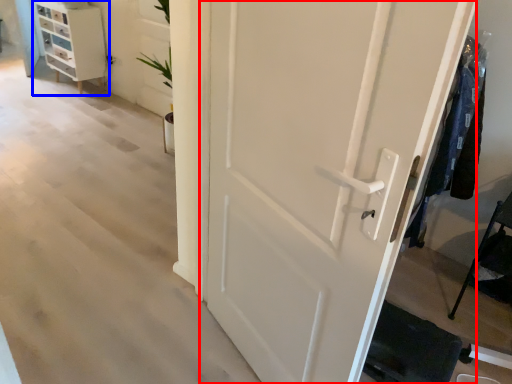
Question: Which object is closer to the camera taking this photo, door (highlighted by a red box) or chest of drawers (highlighted by a blue box)?

Choices:
 (A) door
 (B) chest of drawers

Answer: (A)